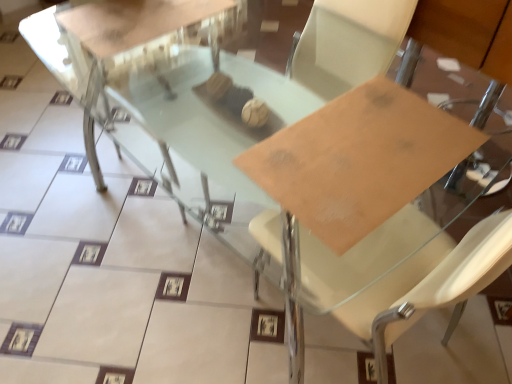
Describe the element at coordinates (359, 160) in the screenshot. I see `matte cardboard at center` at that location.

The image size is (512, 384). What are the coordinates of `matte cardboard at center` in the screenshot? It's located at (359, 160).

Where is `clear glass table at center`? This screenshot has height=384, width=512. clear glass table at center is located at coordinates (121, 44).

Describe the element at coordinates (121, 44) in the screenshot. I see `clear glass table at center` at that location.

Locate an element on the screen. matte cardboard at center is located at coordinates (359, 160).

Consider the image. Considering the positions of objects clear glass table at center and matte cardboard at center in the image provided, who is more to the right, clear glass table at center or matte cardboard at center?

From the viewer's perspective, matte cardboard at center appears more on the right side.

Which object is further away from the camera, clear glass table at center or matte cardboard at center?

clear glass table at center.

Does point (184, 27) lie in front of point (394, 183)?

No, it is not.

From the image's perspective, relative to matte cardboard at center, is clear glass table at center above or below?

From the image's perspective, clear glass table at center appears above matte cardboard at center.

From a real-world perspective, between clear glass table at center and matte cardboard at center, who is vertically higher?

Result: In real-world perspective, matte cardboard at center is above.

Is clear glass table at center wider or thinner than matte cardboard at center?

clear glass table at center is wider than matte cardboard at center.

Who is taller, clear glass table at center or matte cardboard at center?

clear glass table at center is taller.

Considering the sizes of objects clear glass table at center and matte cardboard at center in the image provided, who is bigger, clear glass table at center or matte cardboard at center?

Bigger between the two is clear glass table at center.

Which is correct: clear glass table at center is inside matte cardboard at center, or outside of it?

clear glass table at center is not inside matte cardboard at center, it's outside.

Is clear glass table at center directly adjacent to matte cardboard at center?

No, clear glass table at center is not making contact with matte cardboard at center.

Is clear glass table at center facing towards matte cardboard at center?

Yes.

Find the location of a particular element. Image resolution: width=512 pixels, height=384 pixels. cardboard above the clear glass table at center (from a real-world perspective) is located at coordinates (359, 160).

Considering the positions of objects matte cardboard at center and clear glass table at center in the image provided, who is more to the right, matte cardboard at center or clear glass table at center?

matte cardboard at center.

Is matte cardboard at center positioned in front of clear glass table at center?

Yes.

Is point (306, 220) behind point (98, 174)?

No.

From the image's perspective, would you say matte cardboard at center is positioned over clear glass table at center?

No.

In the scene shown: From a real-world perspective, is matte cardboard at center on clear glass table at center?

Indeed, from a real-world perspective, matte cardboard at center stands above clear glass table at center.

Which object is thinner, matte cardboard at center or clear glass table at center?

matte cardboard at center.

Can you confirm if matte cardboard at center is taller than clear glass table at center?

Incorrect, the height of matte cardboard at center is not larger of that of clear glass table at center.

Is matte cardboard at center bigger or smaller than clear glass table at center?

Considering their sizes, matte cardboard at center takes up less space than clear glass table at center.

Is matte cardboard at center situated inside clear glass table at center or outside?

matte cardboard at center lies outside clear glass table at center.

Is matte cardboard at center positioned far away from clear glass table at center?

matte cardboard at center is far away from clear glass table at center.

Is matte cardboard at center oriented away from clear glass table at center?

No.

How different are the orientations of matte cardboard at center and clear glass table at center in degrees?

93.3 degrees separate the facing orientations of matte cardboard at center and clear glass table at center.

The height and width of the screenshot is (384, 512). I want to click on cardboard to the right of clear glass table at center, so click(x=359, y=160).

Where is `round table lying on the left of matte cardboard at center`? This screenshot has height=384, width=512. round table lying on the left of matte cardboard at center is located at coordinates (121, 44).

Find the location of a particular element. The width and height of the screenshot is (512, 384). cardboard located in front of the clear glass table at center is located at coordinates (359, 160).